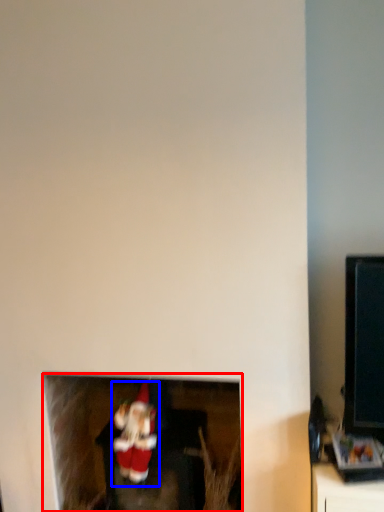
Question: Which point is further to the camera, fireplace (highlighted by a red box) or santa claus (highlighted by a blue box)?

Choices:
 (A) fireplace
 (B) santa claus

Answer: (A)